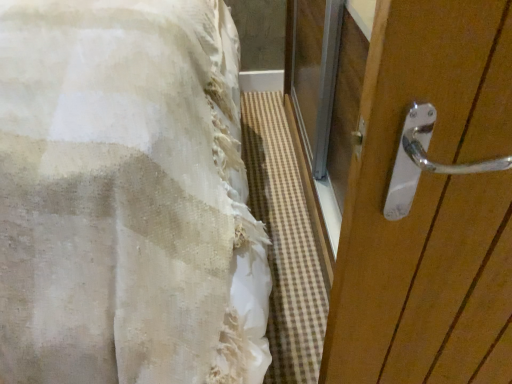
Locate an element on the screen. The height and width of the screenshot is (384, 512). white textured fabric at left is located at coordinates (126, 197).

The height and width of the screenshot is (384, 512). What do you see at coordinates (126, 197) in the screenshot?
I see `white textured fabric at left` at bounding box center [126, 197].

Image resolution: width=512 pixels, height=384 pixels. Describe the element at coordinates (426, 203) in the screenshot. I see `polished wood door handle at right` at that location.

Locate an element on the screen. polished wood door handle at right is located at coordinates (426, 203).

Measure the distance between point (388, 88) and camera.

They are 18.46 inches apart.

Where is `white textured fabric at left`? white textured fabric at left is located at coordinates [x=126, y=197].

Is polished wood door handle at right at the right side of white textured fabric at left?

Correct, you'll find polished wood door handle at right to the right of white textured fabric at left.

Relative to white textured fabric at left, is polished wood door handle at right in front or behind?

polished wood door handle at right is behind white textured fabric at left.

Which is nearer, (x=448, y=97) or (x=11, y=337)?

Point (x=448, y=97) is closer to the camera than point (x=11, y=337).

From the image's perspective, is polished wood door handle at right under white textured fabric at left?

No.

From a real-world perspective, which is physically below, polished wood door handle at right or white textured fabric at left?

polished wood door handle at right.

Between polished wood door handle at right and white textured fabric at left, which one has larger width?

With larger width is white textured fabric at left.

Considering the sizes of objects polished wood door handle at right and white textured fabric at left in the image provided, who is taller, polished wood door handle at right or white textured fabric at left?

white textured fabric at left is taller.

Considering the relative sizes of polished wood door handle at right and white textured fabric at left in the image provided, is polished wood door handle at right smaller than white textured fabric at left?

Yes.

Can we say polished wood door handle at right lies outside white textured fabric at left?

That's correct, polished wood door handle at right is outside of white textured fabric at left.

Is polished wood door handle at right beside white textured fabric at left?

There is a gap between polished wood door handle at right and white textured fabric at left.

Is polished wood door handle at right oriented away from white textured fabric at left?

No, polished wood door handle at right is not facing the opposite direction of white textured fabric at left.

Can you tell me how much polished wood door handle at right and white textured fabric at left differ in facing direction?

The facing directions of polished wood door handle at right and white textured fabric at left are 87.5 degrees apart.

Measure the distance from polished wood door handle at right to white textured fabric at left.

The distance of polished wood door handle at right from white textured fabric at left is 43.09 centimeters.

Where is `bed in front of the polished wood door handle at right`? This screenshot has width=512, height=384. bed in front of the polished wood door handle at right is located at coordinates (126, 197).

From the picture: Is white textured fabric at left to the left or to the right of polished wood door handle at right in the image?

Clearly, white textured fabric at left is on the left of polished wood door handle at right in the image.

In the image, is white textured fabric at left positioned in front of or behind polished wood door handle at right?

Visually, white textured fabric at left is located in front of polished wood door handle at right.

Is point (98, 185) farther from viewer compared to point (498, 79)?

Yes, point (98, 185) is behind point (498, 79).

From the image's perspective, is white textured fabric at left beneath polished wood door handle at right?

Yes.

From a real-world perspective, is white textured fabric at left on polished wood door handle at right?

Correct, in the physical world, white textured fabric at left is higher than polished wood door handle at right.

Which of these two, white textured fabric at left or polished wood door handle at right, is thinner?

With smaller width is polished wood door handle at right.

Who is shorter, white textured fabric at left or polished wood door handle at right?

polished wood door handle at right is shorter.

Considering the relative sizes of white textured fabric at left and polished wood door handle at right in the image provided, is white textured fabric at left smaller than polished wood door handle at right?

Incorrect, white textured fabric at left is not smaller in size than polished wood door handle at right.

Is white textured fabric at left not inside polished wood door handle at right?

white textured fabric at left is positioned outside polished wood door handle at right.

Does white textured fabric at left touch polished wood door handle at right?

They are not placed beside each other.

Is white textured fabric at left oriented towards polished wood door handle at right?

No.

Can you tell me how much white textured fabric at left and polished wood door handle at right differ in facing direction?

The angle between the facing direction of white textured fabric at left and the facing direction of polished wood door handle at right is 87.5 degrees.

Locate an element on the screen. Image resolution: width=512 pixels, height=384 pixels. door lying behind the white textured fabric at left is located at coordinates (426, 203).

Image resolution: width=512 pixels, height=384 pixels. What are the coordinates of `door that is above the white textured fabric at left (from the image's perspective)` in the screenshot? It's located at (426, 203).

I want to click on bed located in front of the polished wood door handle at right, so click(x=126, y=197).